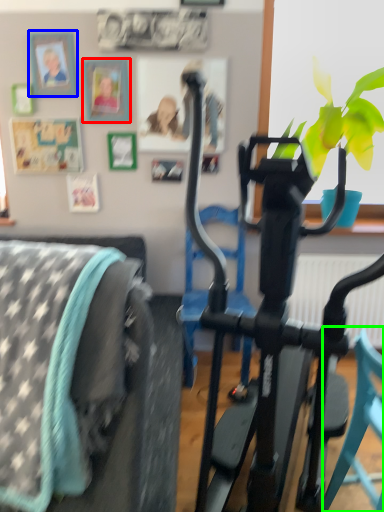
Question: Which object is positioned farthest from picture frame (highlighted by a red box)? Select from picture frame (highlighted by a blue box) and chair (highlighted by a green box).

Choices:
 (A) picture frame
 (B) chair

Answer: (B)